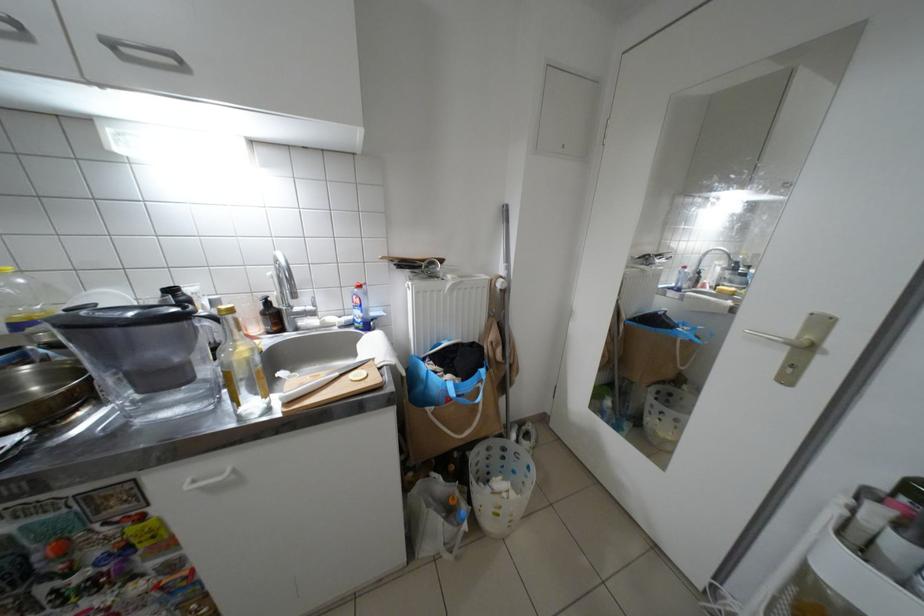
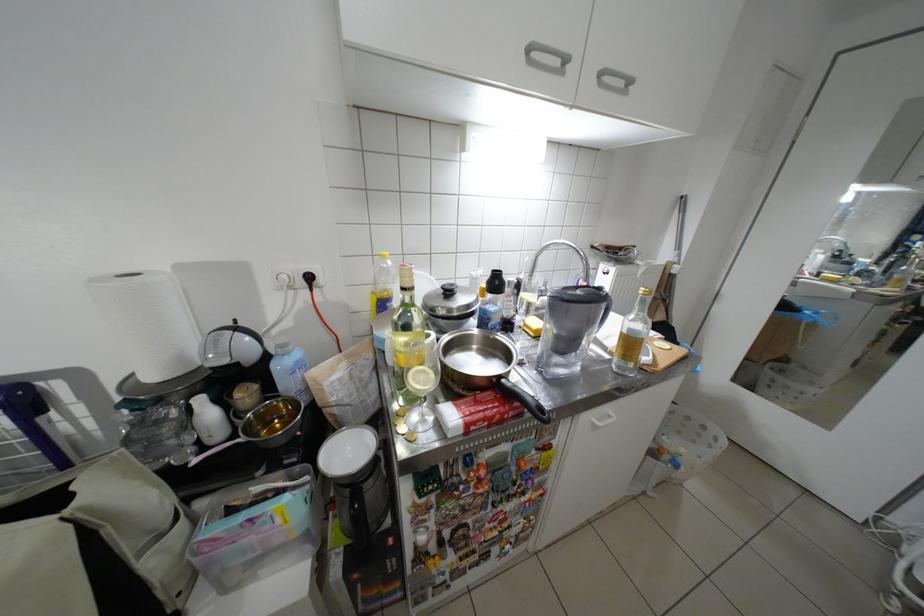
In the second image, find the point that corresponds to (205,483) in the first image.

(610, 421)